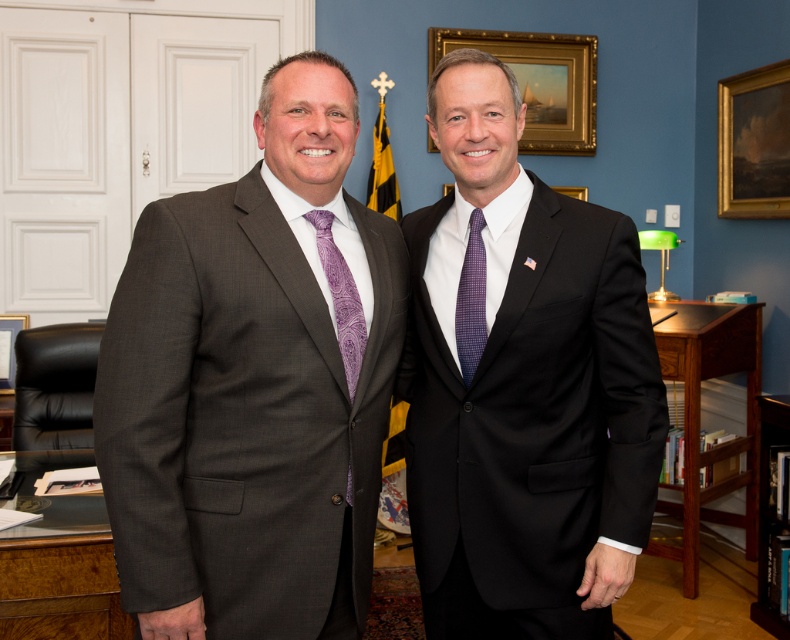
Question: Based on their relative distances, which object is nearer to the brushed metal picture frame at left?

Choices:
 (A) purple paisley tie at center
 (B) wooden picture frame at upper center
 (C) matte gray suit at left
 (D) purple woven tie at center

Answer: (C)

Question: Is matte black suit at right thinner than gold wooden picture frame at upper center?

Choices:
 (A) yes
 (B) no

Answer: (B)

Question: Can you confirm if matte black suit at right is wider than brown wooden bookshelf at right?

Choices:
 (A) yes
 (B) no

Answer: (B)

Question: Which point is closer to the camera?

Choices:
 (A) (491, 99)
 (B) (324, 257)
 (C) (499, 52)

Answer: (B)

Question: Can you confirm if matte gray suit at left is bigger than matte black suit at right?

Choices:
 (A) yes
 (B) no

Answer: (B)

Question: Based on their relative distances, which object is nearer to the purple woven tie at center?

Choices:
 (A) gold wooden picture frame at upper center
 (B) matte black suit at right
 (C) brown wooden bookshelf at right

Answer: (B)